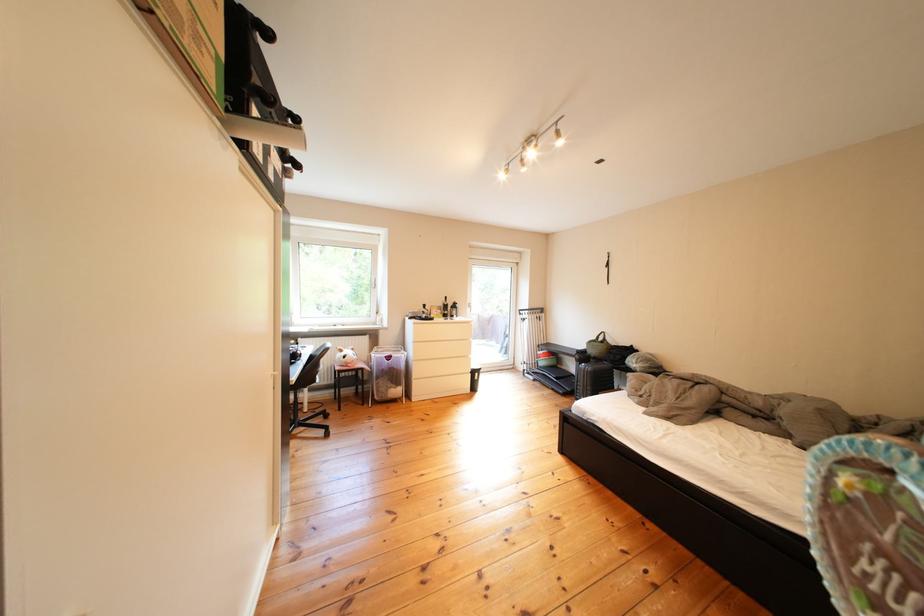
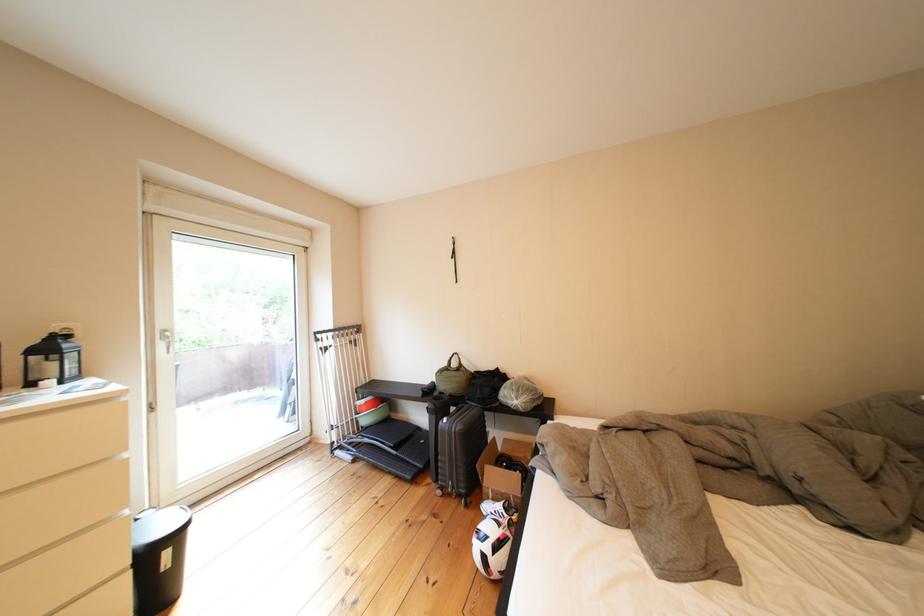
Find the pixel in the second image that matches point 491,379 in the first image.

(179, 557)